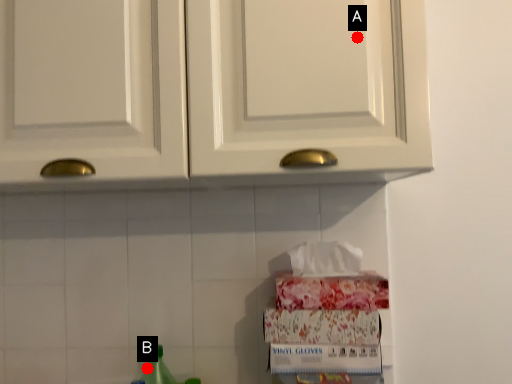
Question: Two points are circled on the image, labeled by A and B beside each circle. Which point is further to the camera?

Choices:
 (A) A is further
 (B) B is further

Answer: (B)